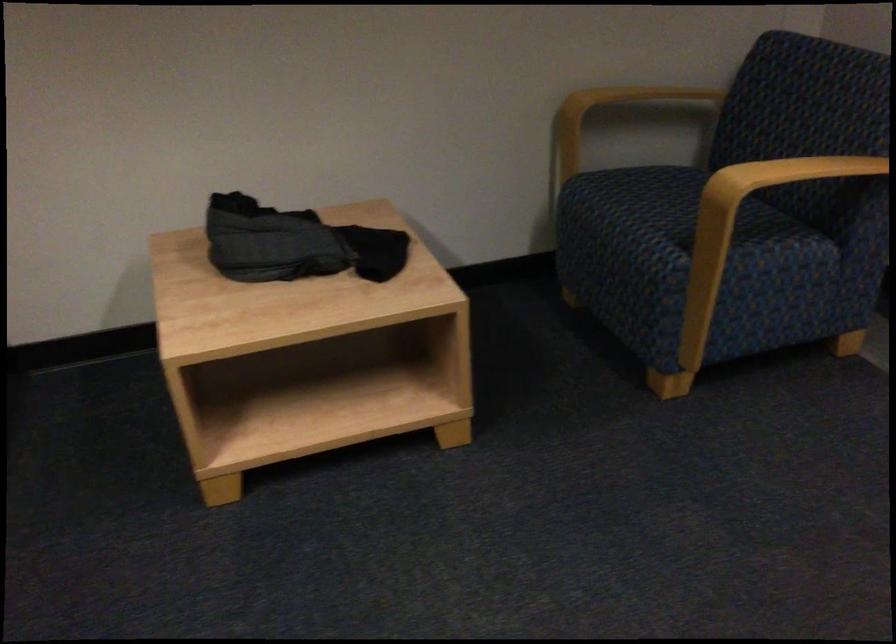
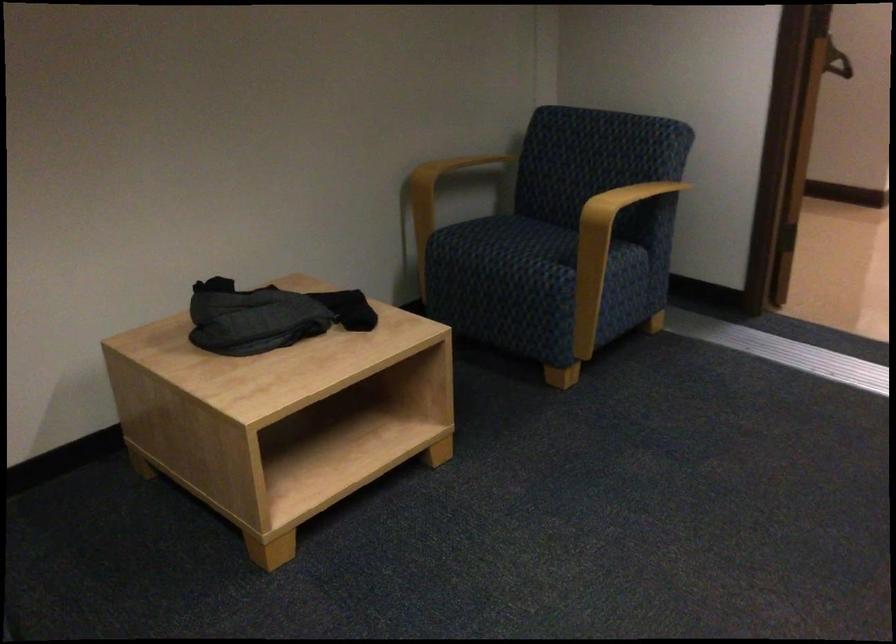
Where in the second image is the point corresponding to point 805,196 from the first image?

(612, 218)